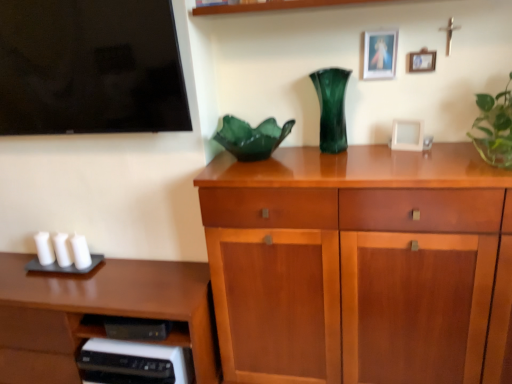
Identify the location of free space in front of white matte candle at left, acting as the first candle starting from the right. This screenshot has width=512, height=384. (64, 289).